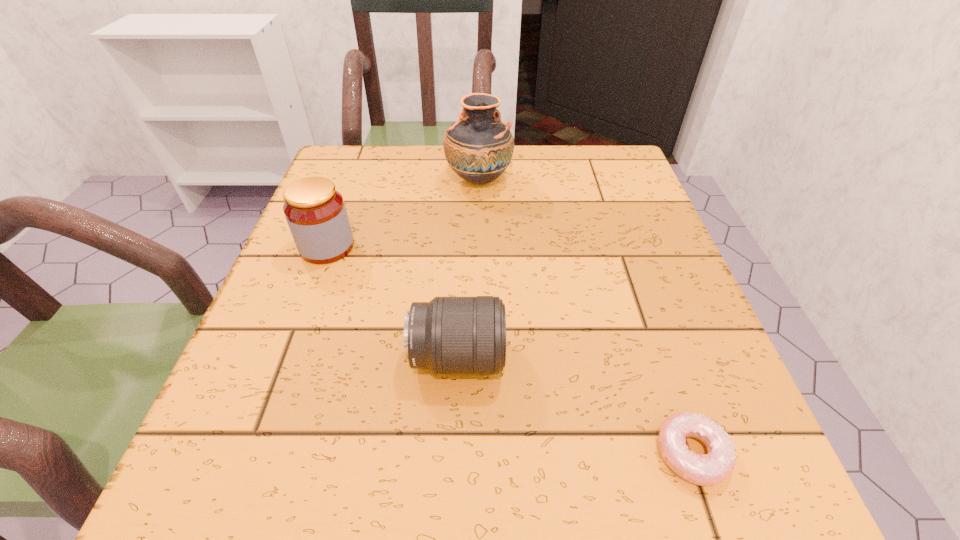
Locate an element on the screen. Image resolution: width=960 pixels, height=540 pixels. unoccupied area between the rightmost object and the third farthest object is located at coordinates coord(574,406).

Identify the location of free space between the tallest object and the third farthest object. (468, 269).

At what (x,y) coordinates should I click in order to perform the action: click on object that is the nearest to the third tallest object. Please return your answer as a coordinate pair (x, y). The image size is (960, 540). Looking at the image, I should click on (x=705, y=470).

What are the coordinates of `the third closest object to the jar` in the screenshot? It's located at (705, 470).

In order to click on free spot that satisfies the following two spatial constraints: 1. on the back side of the nearest object; 2. on the surface of the second nearest object in this screenshot , I will do `click(659, 357)`.

Identify the location of free point that satisfies the following two spatial constraints: 1. on the back side of the shortest object; 2. on the surface of the second shortest object. The width and height of the screenshot is (960, 540). (659, 357).

Locate an element on the screen. This screenshot has height=540, width=960. vacant area in the image that satisfies the following two spatial constraints: 1. on the back side of the doughnut; 2. on the surface of the third tallest object is located at coordinates pyautogui.click(x=659, y=357).

Locate an element on the screen. vacant region that satisfies the following two spatial constraints: 1. on the back side of the pottery; 2. on the right side of the second tallest object is located at coordinates (351, 180).

Where is `free space that satisfies the following two spatial constraints: 1. on the surface of the doughnut; 2. on the left side of the telephoto lens`? This screenshot has height=540, width=960. free space that satisfies the following two spatial constraints: 1. on the surface of the doughnut; 2. on the left side of the telephoto lens is located at coordinates (453, 454).